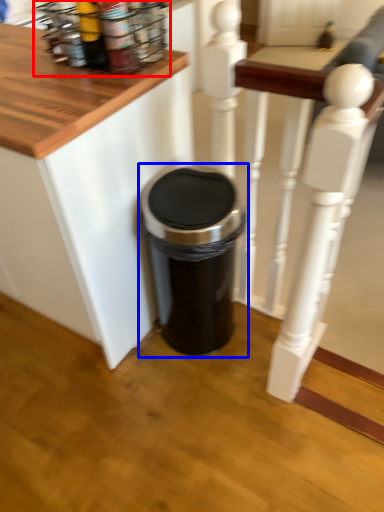
Question: Which object is further to the camera taking this photo, spice rack (highlighted by a red box) or waste container (highlighted by a blue box)?

Choices:
 (A) spice rack
 (B) waste container

Answer: (B)